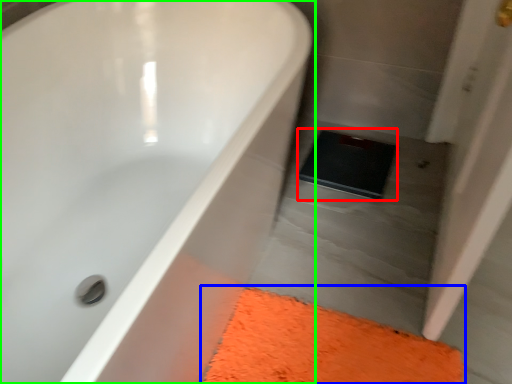
Question: Considering the real-world distances, which object is closest to pad (highlighted by a red box)? bath mat (highlighted by a blue box) or bathtub (highlighted by a green box).

Choices:
 (A) bath mat
 (B) bathtub

Answer: (A)